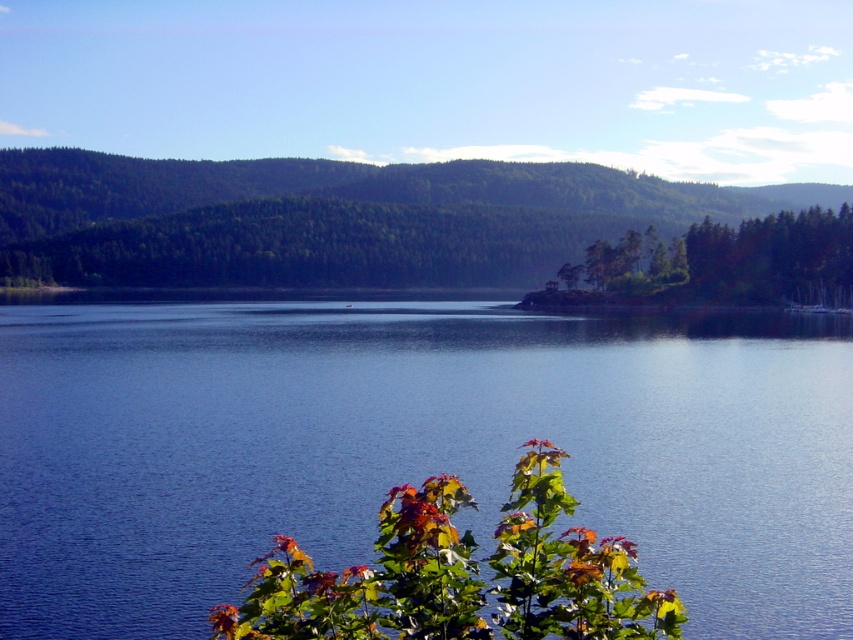
You are standing at the center of the image. Which direction should you look to see the point marked at coordinates (325,218)?

The point at (325,218) is located on the green forested mountain at upper left, so you should look to your upper left direction to see it.